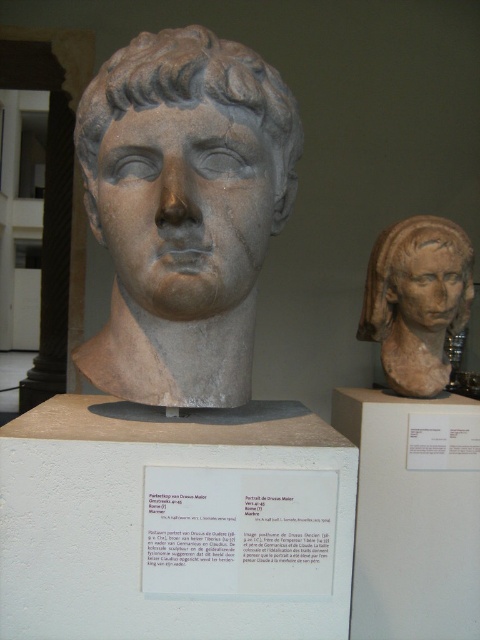
Question: Can you confirm if matte stone bust at right is positioned to the left of gray stone head at center?

Choices:
 (A) no
 (B) yes

Answer: (A)

Question: Does matte stone bust at right have a greater width compared to brown clay head at upper right?

Choices:
 (A) no
 (B) yes

Answer: (B)

Question: Among these objects, which one is farthest from the camera?

Choices:
 (A) matte stone bust at right
 (B) gray stone head at center
 (C) brown clay head at upper right

Answer: (C)

Question: Estimate the real-world distances between objects in this image. Which object is farther from the brown clay head at upper right?

Choices:
 (A) matte stone bust at right
 (B) gray stone head at center

Answer: (B)

Question: Is matte stone bust at right thinner than brown clay head at upper right?

Choices:
 (A) no
 (B) yes

Answer: (A)

Question: Which point is farther from the camera taking this photo?

Choices:
 (A) (397, 230)
 (B) (397, 483)

Answer: (A)